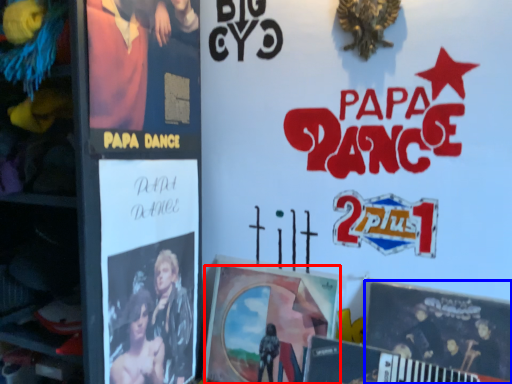
Question: Which object appears closest to the camera in this image, poster (highlighted by a red box) or poster (highlighted by a blue box)?

Choices:
 (A) poster
 (B) poster

Answer: (B)